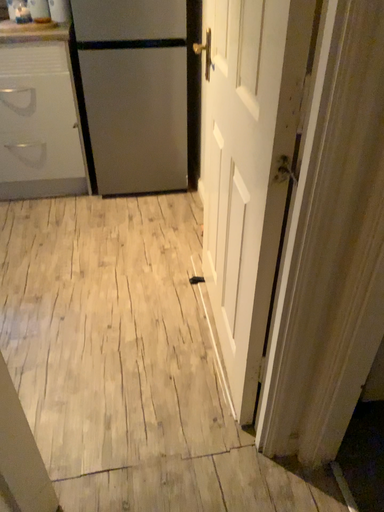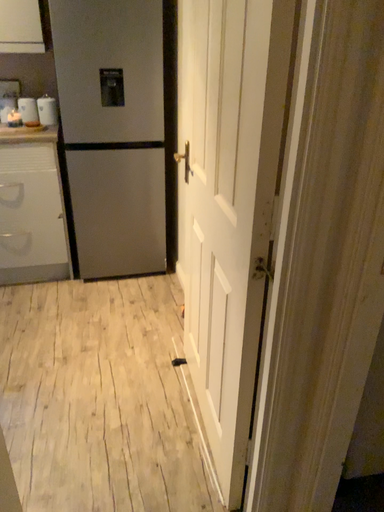
Question: How did the camera likely rotate when shooting the video?

Choices:
 (A) rotated downward
 (B) rotated upward

Answer: (B)